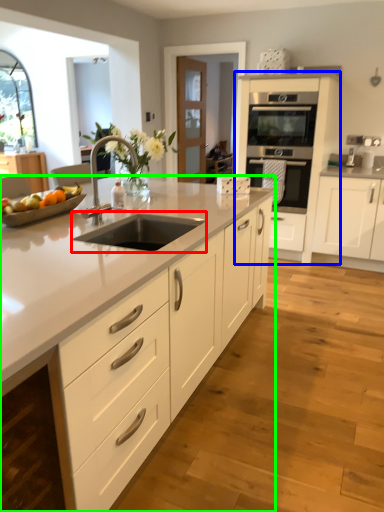
Question: Estimate the real-world distances between objects in this image. Which object is farther from open (highlighted by a red box), cabinetry (highlighted by a blue box) or countertop (highlighted by a green box)?

Choices:
 (A) cabinetry
 (B) countertop

Answer: (A)